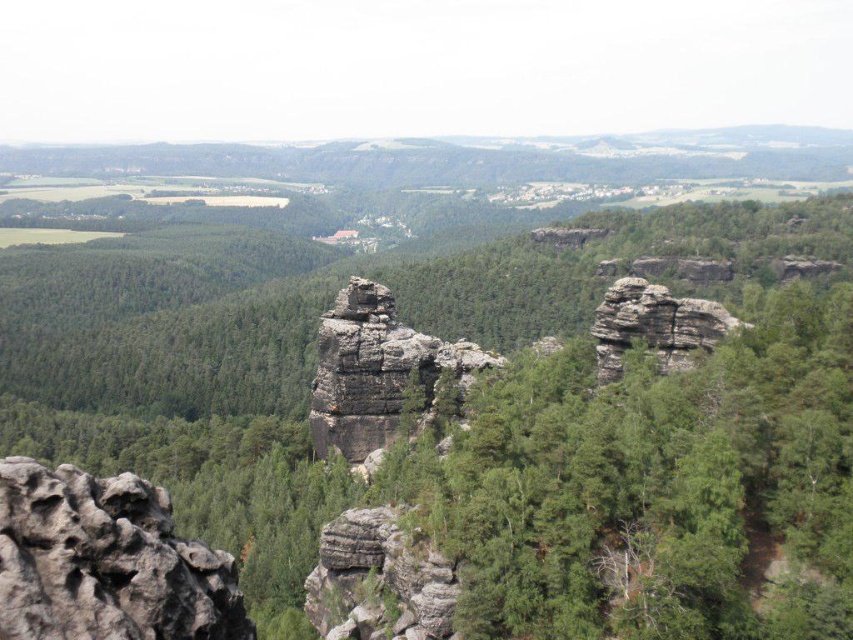
Question: Which object appears farthest from the camera in this image?

Choices:
 (A) rough stone rock at lower left
 (B) green rough rock at center
 (C) rugged stone rock formation at center
 (D) rugged stone rock at center

Answer: (C)

Question: Is green rough rock at center to the left of rugged stone rock formation at center from the viewer's perspective?

Choices:
 (A) yes
 (B) no

Answer: (A)

Question: Among these objects, which one is nearest to the camera?

Choices:
 (A) rugged stone rock at center
 (B) green rough rock at center
 (C) rugged stone rock formation at center

Answer: (B)

Question: Can you confirm if green rough rock at center is bigger than rugged stone rock at center?

Choices:
 (A) yes
 (B) no

Answer: (A)

Question: Is the position of rough stone rock at lower left less distant than that of rugged stone rock at center?

Choices:
 (A) yes
 (B) no

Answer: (A)

Question: Among these points, which one is farthest from the camera?

Choices:
 (A) (375, 353)
 (B) (125, 628)

Answer: (A)